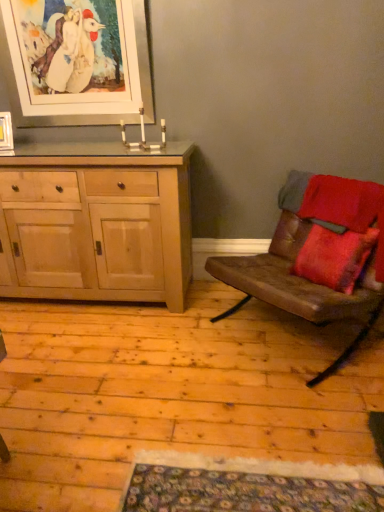
Locate an element on the screen. Image resolution: width=384 pixels, height=512 pixels. vacant area on top of natural wood cabinet at left (from a real-world perspective) is located at coordinates pos(89,151).